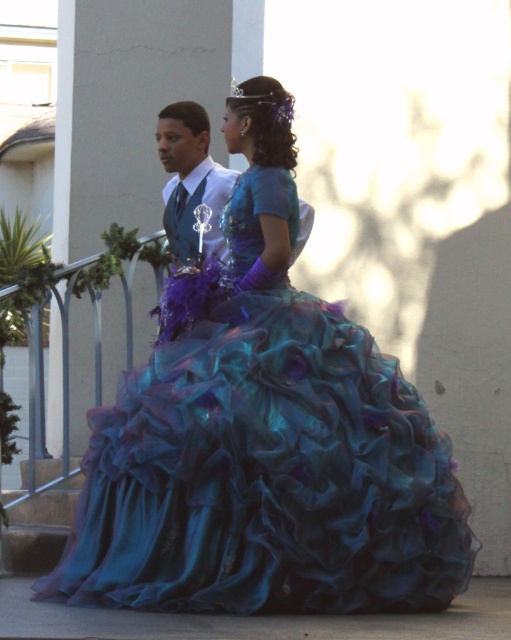
Who is higher up, teal satin gown at center or matte blue suit at center?

matte blue suit at center is higher up.

Is point (211, 468) farther from camera compared to point (206, 161)?

No, it is in front of (206, 161).

Locate an element on the screen. The image size is (511, 640). teal satin gown at center is located at coordinates (267, 476).